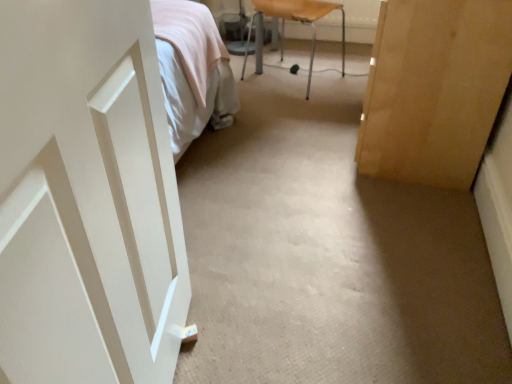
Identify the location of free region under metallic silver chair at upper center (from a real-world perspective). This screenshot has width=512, height=384. (285, 87).